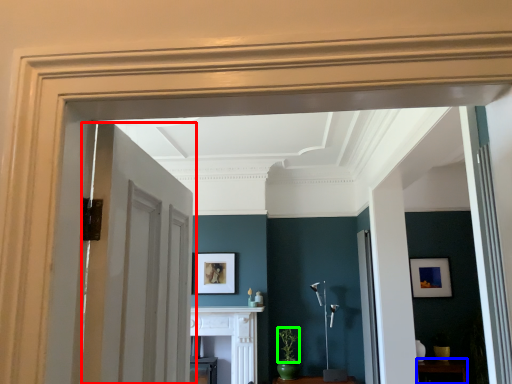
Question: Estimate the real-world distances between objects in this image. Which object is closer to door (highlighted by a red box), furniture (highlighted by a blue box) or plant (highlighted by a green box)?

Choices:
 (A) furniture
 (B) plant

Answer: (B)